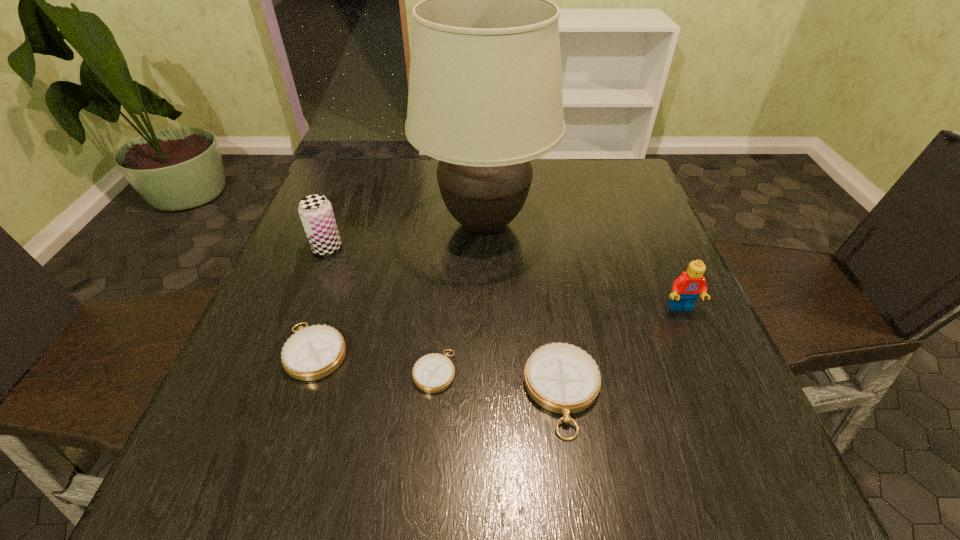
I want to click on vacant area at the near edge of the desktop, so click(x=400, y=418).

Find the location of a particular element. The image size is (960, 540). free space at the left edge of the desktop is located at coordinates (300, 259).

In the image, there is a desktop. Where is `free space at the right edge`? The image size is (960, 540). free space at the right edge is located at coordinates (636, 231).

Find the location of a particular element. vacant space at the far left corner of the desktop is located at coordinates (x=358, y=204).

Locate an element on the screen. This screenshot has width=960, height=540. free spot at the near left corner of the desktop is located at coordinates (273, 386).

The image size is (960, 540). I want to click on vacant area that lies between the tallest object and the shortest object, so click(x=459, y=298).

Identify the location of vacant area that lies between the tallest object and the leftmost compass. (400, 287).

Where is `free space between the second compass from right to left and the second tallest compass`? The image size is (960, 540). free space between the second compass from right to left and the second tallest compass is located at coordinates (375, 361).

Identify the location of vacant region between the second tallest compass and the tallest object. (400, 287).

Identify the location of vacant area between the second compass from right to left and the beer can. (381, 309).